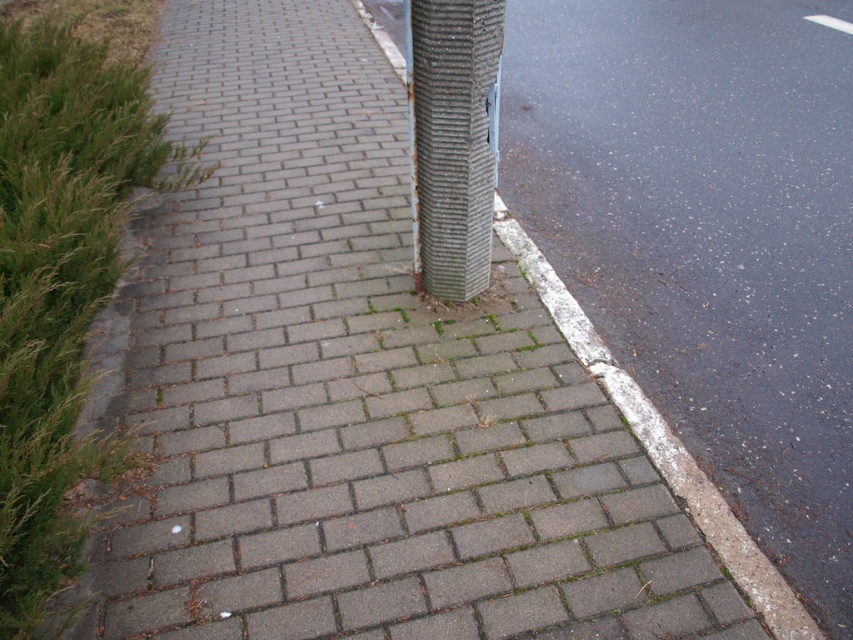
You are a pedestrian walking along the sidewalk and want to reach the white concrete curb at lower right. Which direction should you walk relative to the rough textured pole at center?

You should walk towards the right side of the rough textured pole at center because the white concrete curb at lower right is located behind it.

You are a delivery robot navigating the sidewalk. You need to deliver a package to the address located near the rough textured pole at center and the white concrete curb at lower right. Which object should you approach first if you want to reach the destination efficiently?

The rough textured pole at center is positioned on the left side of white concrete curb at lower right. Therefore, you should approach the rough textured pole at center first before reaching the white concrete curb at lower right to efficiently reach the destination.

You are a delivery person trying to park your bike. You see the rough textured pole at center and the white concrete curb at lower right. Which object is narrower, and can you park your bike between them if your bike is 1 meter wide?

The rough textured pole at center is narrower than the white concrete curb at lower right. Since the pole is narrower, but the description only mentions their widths relative to each other, not the actual space between them, it is unclear if there is enough space for the bike. You should measure the distance between them first.